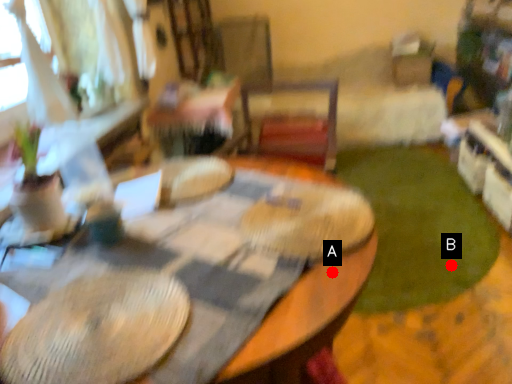
Question: Two points are circled on the image, labeled by A and B beside each circle. Which point is farther to the camera?

Choices:
 (A) A is further
 (B) B is further

Answer: (B)